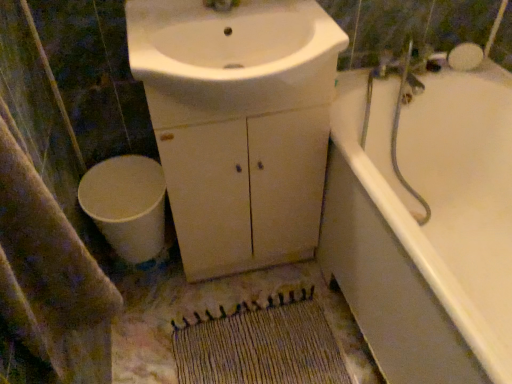
I want to click on white glossy bathtub at right, so click(426, 225).

Measure the distance between point (203, 319) and camera.

4.59 feet.

Describe the element at coordinates (50, 274) in the screenshot. I see `beige textured bath towel at lower left` at that location.

This screenshot has height=384, width=512. What do you see at coordinates (234, 54) in the screenshot?
I see `white glossy sink at center` at bounding box center [234, 54].

Describe the element at coordinates (241, 183) in the screenshot. I see `white matte cabinet at center` at that location.

Where is `white glossy bathtub at right`? The image size is (512, 384). white glossy bathtub at right is located at coordinates (426, 225).

Considering the positions of point (140, 214) and point (488, 284), is point (140, 214) closer or farther from the camera than point (488, 284)?

Clearly, point (140, 214) is more distant from the camera than point (488, 284).

Which object is closer to the camera taking this photo, white matte toilet at lower left or white glossy bathtub at right?

white glossy bathtub at right is more forward.

Can white glossy bathtub at right be found inside white matte toilet at lower left?

Actually, white glossy bathtub at right is outside white matte toilet at lower left.

Which is more to the right, white matte toilet at lower left or white glossy bathtub at right?

From the viewer's perspective, white glossy bathtub at right appears more on the right side.

From a real-world perspective, is white matte toilet at lower left on white matte cabinet at center?

No.

Which object is further away from the camera taking this photo, white matte toilet at lower left or white matte cabinet at center?

white matte toilet at lower left is further from the camera.

Considering the relative sizes of white matte toilet at lower left and white matte cabinet at center in the image provided, is white matte toilet at lower left taller than white matte cabinet at center?

Incorrect, the height of white matte toilet at lower left is not larger of that of white matte cabinet at center.

Is white glossy bathtub at right located within woven beige mat at lower center?

No, white glossy bathtub at right is not inside woven beige mat at lower center.

Visually, is woven beige mat at lower center positioned to the left or to the right of white glossy bathtub at right?

From the image, it's evident that woven beige mat at lower center is to the left of white glossy bathtub at right.

Can you confirm if white glossy bathtub at right is bigger than beige textured bath towel at lower left?

Yes.

From a real-world perspective, between white glossy bathtub at right and beige textured bath towel at lower left, who is vertically higher?

From a 3D spatial view, beige textured bath towel at lower left is above.

Could you tell me if white glossy bathtub at right is facing beige textured bath towel at lower left?

Yes.

Which is nearer, (485, 233) or (60, 217)?

Point (485, 233) is farther from the camera than point (60, 217).

Is beige textured bath towel at lower left completely or partially inside white glossy sink at center?

No.

Which of these two, white glossy sink at center or beige textured bath towel at lower left, stands taller?

beige textured bath towel at lower left is taller.

Can you confirm if white glossy sink at center is thinner than beige textured bath towel at lower left?

No, white glossy sink at center is not thinner than beige textured bath towel at lower left.

In the scene shown: Is beige textured bath towel at lower left with white glossy sink at center?

beige textured bath towel at lower left is not next to white glossy sink at center, and they're not touching.

Which object is wider, beige textured bath towel at lower left or white glossy sink at center?

Wider between the two is white glossy sink at center.

Is beige textured bath towel at lower left spatially inside white glossy sink at center, or outside of it?

beige textured bath towel at lower left cannot be found inside white glossy sink at center.

Is beige textured bath towel at lower left turned away from white glossy sink at center?

That's not correct — beige textured bath towel at lower left is not looking away from white glossy sink at center.

In order to click on toilet below the white glossy sink at center (from the image's perspective) in this screenshot , I will do `click(127, 205)`.

From the image's perspective, who appears lower, white matte toilet at lower left or white glossy sink at center?

white matte toilet at lower left is shown below in the image.

Measure the distance from white matte toilet at lower left to white glossy sink at center.

white matte toilet at lower left and white glossy sink at center are 20.12 inches apart from each other.

Can you confirm if white matte toilet at lower left is positioned to the left of white glossy sink at center?

Yes.

What are the coordinates of `toilet that appears above the white glossy bathtub at right (from the image's perspective)` in the screenshot? It's located at (127, 205).

Identify the location of toilet located below the white matte cabinet at center (from the image's perspective). (127, 205).

Based on their spatial positions, is white matte cabinet at center or beige textured bath towel at lower left closer to white glossy sink at center?

white matte cabinet at center.

Considering their positions, is white glossy sink at center positioned closer to white matte cabinet at center than white glossy bathtub at right?

white glossy sink at center.

Which object lies further to the anchor point white matte toilet at lower left, white glossy bathtub at right or beige textured bath towel at lower left?

Based on the image, white glossy bathtub at right appears to be further to white matte toilet at lower left.

Which object lies nearer to the anchor point woven beige mat at lower center, white glossy bathtub at right or white glossy sink at center?

The object closer to woven beige mat at lower center is white glossy bathtub at right.

When comparing their distances from white glossy sink at center, does white glossy bathtub at right or beige textured bath towel at lower left seem further?

Among the two, beige textured bath towel at lower left is located further to white glossy sink at center.

From the image, which object appears to be nearer to white glossy bathtub at right, beige textured bath towel at lower left or white glossy sink at center?

white glossy sink at center is closer to white glossy bathtub at right.

Based on their spatial positions, is white matte toilet at lower left or white matte cabinet at center further from beige textured bath towel at lower left?

white matte cabinet at center is positioned further to the anchor beige textured bath towel at lower left.

Looking at this image, from the image, which object appears to be farther from white matte toilet at lower left, woven beige mat at lower center or white matte cabinet at center?

The object further to white matte toilet at lower left is woven beige mat at lower center.

Identify the location of cabinetry located between beige textured bath towel at lower left and white matte toilet at lower left in the depth direction. (241, 183).

Locate an element on the screen. This screenshot has height=384, width=512. cabinetry that lies between white glossy sink at center and white matte toilet at lower left from top to bottom is located at coordinates (241, 183).

Where is `doormat between beige textured bath towel at lower left and white matte toilet at lower left from front to back`? The height and width of the screenshot is (384, 512). doormat between beige textured bath towel at lower left and white matte toilet at lower left from front to back is located at coordinates (260, 344).

Where is `doormat between beige textured bath towel at lower left and white glossy bathtub at right`? This screenshot has height=384, width=512. doormat between beige textured bath towel at lower left and white glossy bathtub at right is located at coordinates coord(260,344).